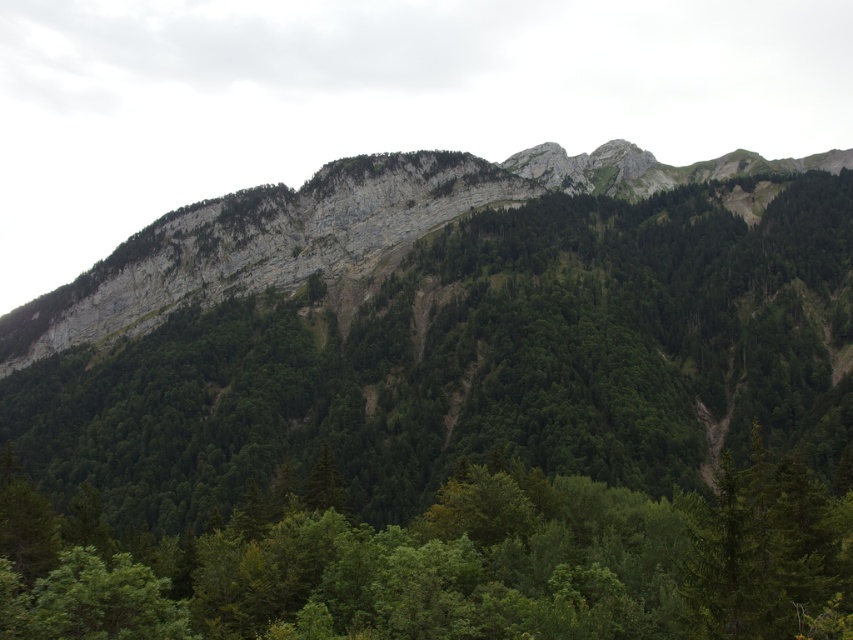
You are a hiker standing at the base of the mountain. You spot two points marked on the map as point 1 at coordinates (264, 605) and point 2 at coordinates (347, 196). Which point is closer to you?

Point 1 at coordinates (264, 605) is closer to you because it is in front of point 2 at coordinates (347, 196).

You are a hiker standing at the base of the mountain. You see a green matte tree at lower center and a green rock at center. Which object is closer to you?

Answer: The green matte tree at lower center is closer to you because it is located below the green rock at center, meaning it is positioned nearer in the foreground.

You are a hiker standing at the base of the mountain. You see a green matte tree at lower center and a green rock at center. How far apart are these two landmarks?

The green matte tree at lower center and green rock at center are 188.92 meters apart.